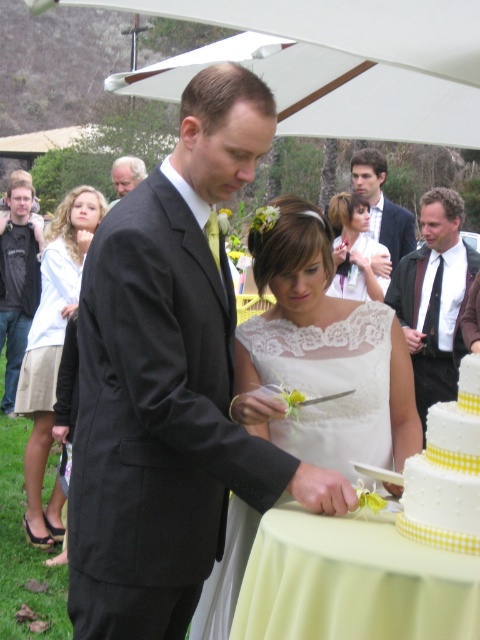
You are a photographer at the wedding and need to capture a closeup shot of the couple cutting the cake. Since the black satin suit at center and the gray hair at upper left are both in the frame, which one should you focus on to ensure the subject is in focus given the camera can only focus on one subject at a time?

The black satin suit at center is bigger than gray hair at upper left, so focusing on the black satin suit at center would ensure the subject is in focus as it is larger and likely the main focus.

You are a photographer at a wedding. You need to capture a closeup shot of the couple cutting the cake. The black satin suit at center and yellow checkered fabric at lower right are in your frame. Can you fit both in the frame if your camera has a 18 inch wide field of view?

The black satin suit at center and yellow checkered fabric at lower right are 20.27 inches apart. Since the distance between them exceeds the camera field of view of 18 inches, you cannot fit both in the frame.

You are a photographer at the wedding. You want to take a photo of the black satin suit at center without the yellow checkered fabric at lower right showing in the background. Is this possible based on their positions?

The yellow checkered fabric at lower right is behind the black satin suit at center, so if positioned correctly, the photographer can capture the black satin suit at center while blocking the yellow checkered fabric at lower right from view by adjusting the camera angle or framing.